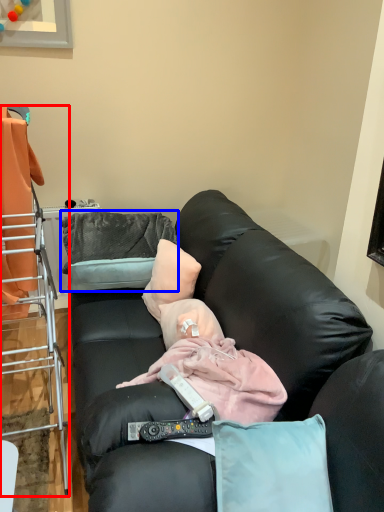
Question: Among these objects, which one is nearest to the camera, cabinetry (highlighted by a red box) or pillow (highlighted by a blue box)?

Choices:
 (A) cabinetry
 (B) pillow

Answer: (A)